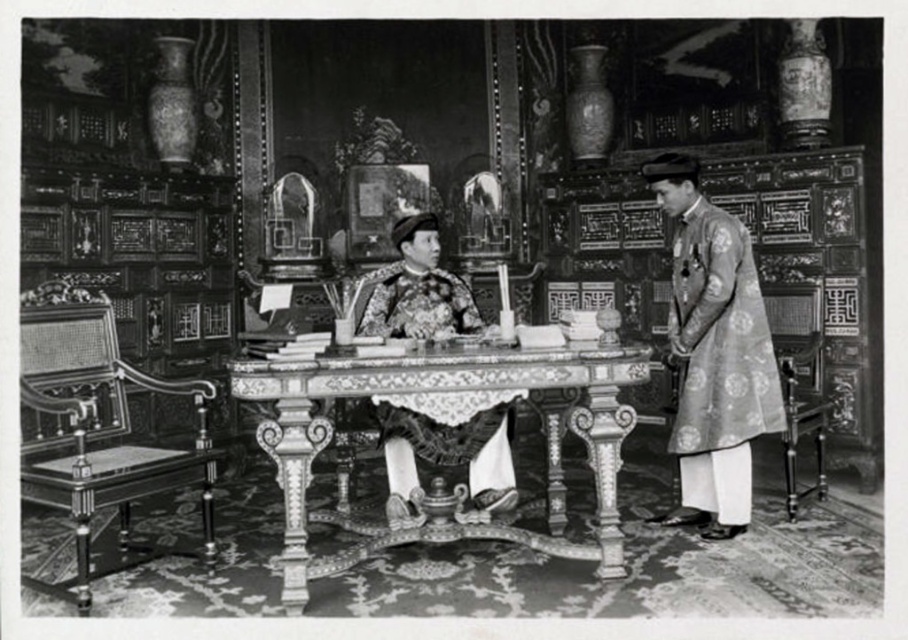
Question: Considering the relative positions of decorative wood table at center and embroidered silk robe at center in the image provided, where is decorative wood table at center located with respect to embroidered silk robe at center?

Choices:
 (A) above
 (B) below

Answer: (B)

Question: Where is silky brocade robe at right located in relation to embroidered silk robe at center in the image?

Choices:
 (A) left
 (B) right

Answer: (B)

Question: Estimate the real-world distances between objects in this image. Which object is closer to the embroidered silk robe at center?

Choices:
 (A) silky brocade robe at right
 (B) decorative wood table at center

Answer: (B)

Question: Which of the following is the closest to the observer?

Choices:
 (A) (522, 362)
 (B) (512, 493)
 (C) (733, 371)

Answer: (A)

Question: Is decorative wood table at center positioned before silky brocade robe at right?

Choices:
 (A) yes
 (B) no

Answer: (A)

Question: Which object is the farthest from the embroidered silk robe at center?

Choices:
 (A) decorative wood table at center
 (B) silky brocade robe at right

Answer: (B)